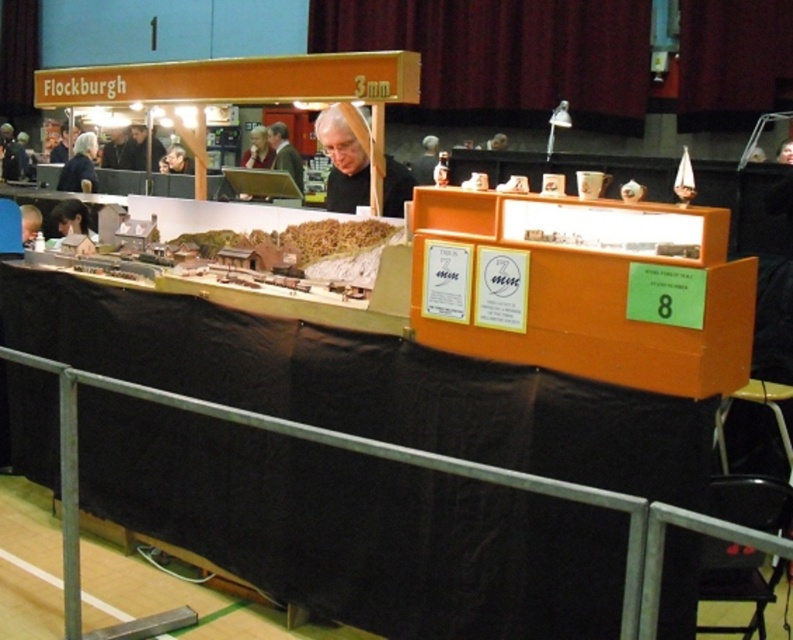
You are a model railway enthusiast inspecting the display. You notice a specific point marked at coordinates (79, 164). What object is located at this point?

The object located at point (79, 164) is the black fabric at left.

Based on the photo, you are a model railway enthusiast standing at the exhibition. You notice two items at the left side of the layout. One is the black fabric at left and the other is matte black hair at left. From your perspective, which item is closer to you?

The black fabric at left is closer to you because the matte black hair at left is behind it.

You are a visitor at the model railway exhibition and notice the black fabric at left and the dark brown leather jacket at center. Which object is located to the left of the other?

The black fabric at left is positioned on the left side of dark brown leather jacket at center.